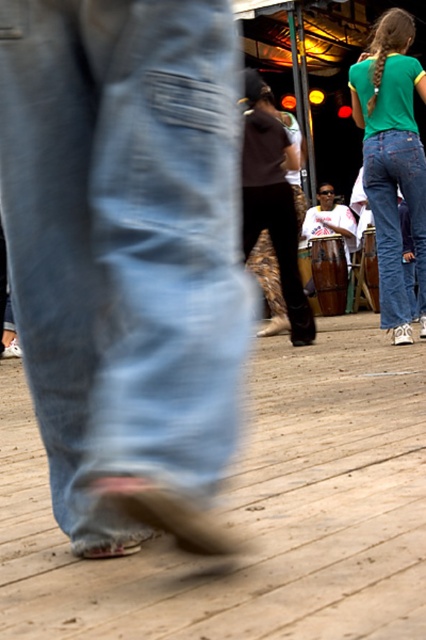
You are a photographer trying to capture a photo of both the denim jeans at lower left and the green denim jeans at upper right in the same frame. Given that your camera has a maximum focus range of 4 meters, will you be able to include both subjects in the shot?

The distance between the denim jeans at lower left and the green denim jeans at upper right is 4.21 meters. Since your camera can only focus up to 4 meters, you won

You are a photographer trying to capture a photo of the white matte drum at center without the denim jeans at lower left appearing in the foreground. Based on their positions, is this possible?

The denim jeans at lower left is below the white matte drum at center, so adjusting the camera angle upwards might allow you to frame the shot so the denim jeans at lower left is out of view while keeping the white matte drum at center in focus.